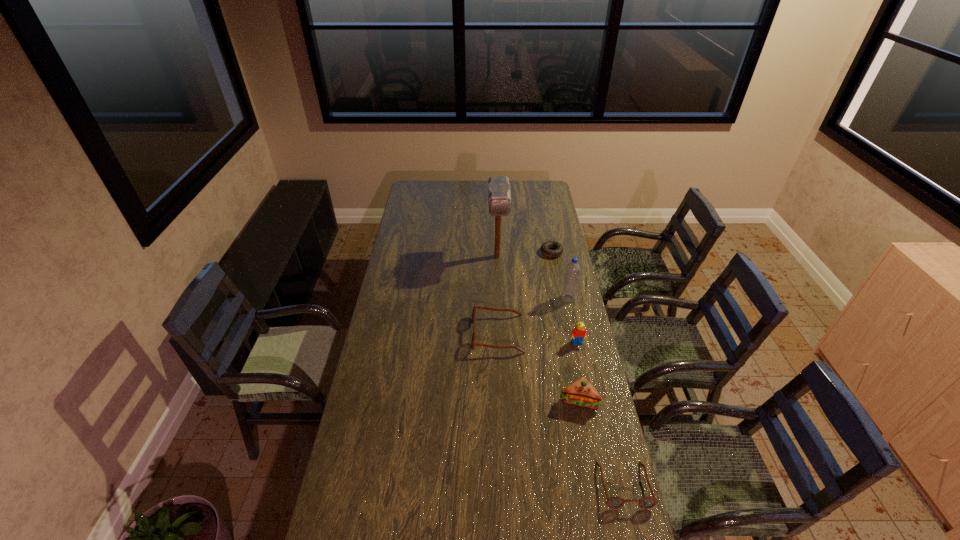
You are a GUI agent. You are given a task and a screenshot of the screen. Output one action in this format:
    pyautogui.click(x=<x>, y=<y>)
    Task: Click on the unoccupied area between the sixth shortest object and the Lego
    The image size is (960, 540).
    Given the screenshot: What is the action you would take?
    pyautogui.click(x=573, y=321)

Identify which object is located as the third nearest to the sixth shortest object. Please provide its 2D coordinates. Your answer should be formatted as a tuple, i.e. [(x, y)], where the tuple contains the x and y coordinates of a point satisfying the conditions above.

[(546, 247)]

The width and height of the screenshot is (960, 540). I want to click on object that is the second closest to the shortest object, so click(x=573, y=268).